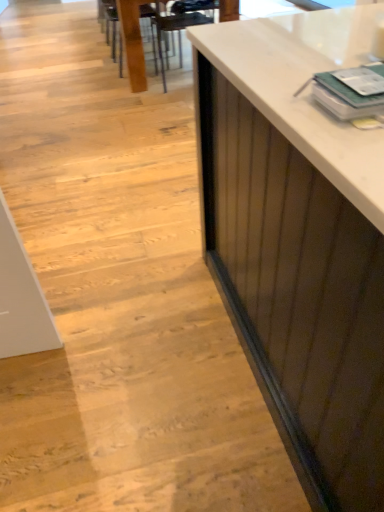
Question: Does wooden table at center have a greater width compared to metallic dark brown armchair at upper center?

Choices:
 (A) no
 (B) yes

Answer: (B)

Question: Could metallic dark brown armchair at upper center be considered to be inside wooden table at center?

Choices:
 (A) yes
 (B) no

Answer: (A)

Question: From the image's perspective, does wooden table at center appear lower than metallic dark brown armchair at upper center?

Choices:
 (A) yes
 (B) no

Answer: (B)

Question: Is metallic dark brown armchair at upper center at the back of wooden table at center?

Choices:
 (A) yes
 (B) no

Answer: (B)

Question: Does wooden table at center have a smaller size compared to metallic dark brown armchair at upper center?

Choices:
 (A) no
 (B) yes

Answer: (A)

Question: Considering their positions, is wooden chair at upper center located in front of or behind wooden table at center?

Choices:
 (A) front
 (B) behind

Answer: (B)

Question: Is wooden chair at upper center wider or thinner than wooden table at center?

Choices:
 (A) wide
 (B) thin

Answer: (B)

Question: Considering the positions of wooden chair at upper center and wooden table at center in the image, is wooden chair at upper center bigger or smaller than wooden table at center?

Choices:
 (A) big
 (B) small

Answer: (B)

Question: From a real-world perspective, is wooden chair at upper center above or below wooden table at center?

Choices:
 (A) above
 (B) below

Answer: (B)

Question: From a real-world perspective, is metallic dark brown armchair at upper center above or below wooden chair at upper center?

Choices:
 (A) above
 (B) below

Answer: (A)

Question: Considering the positions of metallic dark brown armchair at upper center and wooden chair at upper center in the image, is metallic dark brown armchair at upper center bigger or smaller than wooden chair at upper center?

Choices:
 (A) small
 (B) big

Answer: (B)

Question: Which is correct: metallic dark brown armchair at upper center is inside wooden chair at upper center, or outside of it?

Choices:
 (A) inside
 (B) outside

Answer: (B)

Question: In terms of width, does metallic dark brown armchair at upper center look wider or thinner when compared to wooden chair at upper center?

Choices:
 (A) thin
 (B) wide

Answer: (B)

Question: Considering the relative positions of wooden table at center and wooden chair at upper center in the image provided, is wooden table at center to the left or to the right of wooden chair at upper center?

Choices:
 (A) left
 (B) right

Answer: (B)

Question: From the image's perspective, relative to wooden chair at upper center, is wooden table at center above or below?

Choices:
 (A) above
 (B) below

Answer: (A)